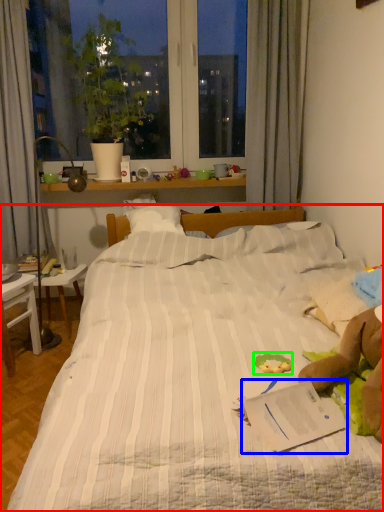
Question: Based on their relative distances, which object is farther from bed (highlighted by a red box)? Choose from paperback book (highlighted by a blue box) and stuff (highlighted by a green box).

Choices:
 (A) paperback book
 (B) stuff

Answer: (B)